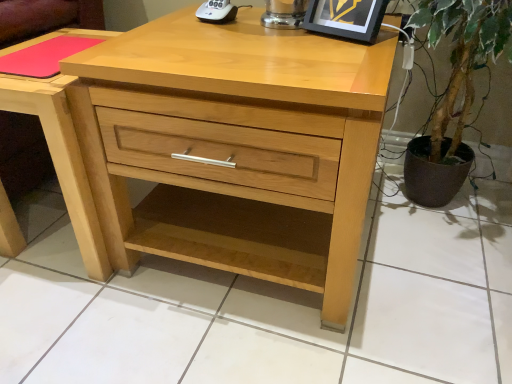
You are a GUI agent. You are given a task and a screenshot of the screen. Output one action in this format:
    pyautogui.click(x=<x>, y=<y>)
    Task: Click on the vacant area on top of light wood nightstand at center (from a real-world perspective)
    
    Given the screenshot: What is the action you would take?
    pyautogui.click(x=53, y=49)